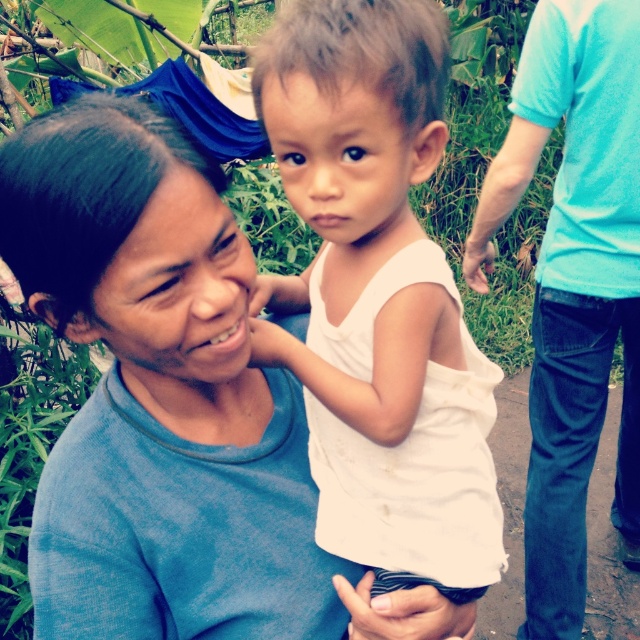
You are a photographer standing at the scene. You want to take a closeup shot of the white cotton shirt at center. What is the minimum distance you need to move forward to ensure the subject fills the frame?

The white cotton shirt at center is 25.84 inches away from the camera. To take a closeup shot, you need to move forward until the shirt fills the frame, but since the exact focal length isn not provided, the minimum distance would depend on the camera equipment used.